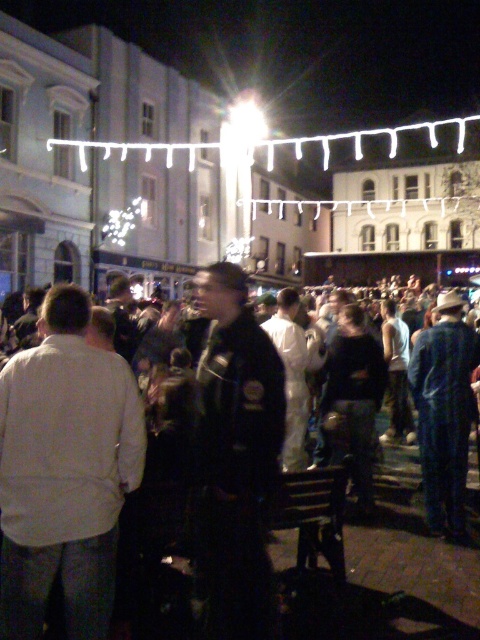
You are a photographer trying to capture a candid shot of the crowd in the public square. You notice the white matte shirt at center and the blue denim jeans at lower right. Which of these two items is positioned closer to the left side of the scene?

The white matte shirt at center is to the left of the blue denim jeans at lower right, so it is positioned closer to the left side of the scene.

You are a photographer trying to capture a candid shot of the crowd in the public square. You notice two distinct figures in the scene. The first is a person wearing a white matte shirt at center, and the second is someone in blue denim jeans at lower right. To ensure both are in focus, you need to adjust your camera settings. Considering their sizes, which figure would require a closer focus to capture details?

The white matte shirt at center has a larger size compared to blue denim jeans at lower right, so to capture details, the photographer should focus closer on the white matte shirt at center since it is larger and might be nearer or require more detailed attention.